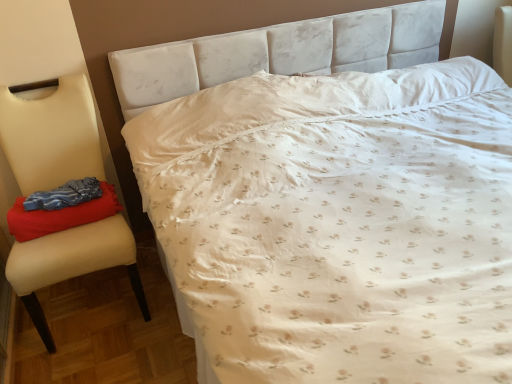
Question: Is beige leather chair at left bigger than velvety red blanket at left?

Choices:
 (A) yes
 (B) no

Answer: (A)

Question: Does beige leather chair at left have a smaller size compared to velvety red blanket at left?

Choices:
 (A) no
 (B) yes

Answer: (A)

Question: From the image's perspective, is beige leather chair at left located above velvety red blanket at left?

Choices:
 (A) no
 (B) yes

Answer: (A)

Question: Is beige leather chair at left not near velvety red blanket at left?

Choices:
 (A) yes
 (B) no

Answer: (B)

Question: Does beige leather chair at left appear on the left side of velvety red blanket at left?

Choices:
 (A) no
 (B) yes

Answer: (B)

Question: Is beige leather chair at left positioned behind velvety red blanket at left?

Choices:
 (A) yes
 (B) no

Answer: (B)

Question: Does velvety red blanket at left have a smaller size compared to beige leather chair at left?

Choices:
 (A) yes
 (B) no

Answer: (A)

Question: From the image's perspective, is velvety red blanket at left below beige leather chair at left?

Choices:
 (A) no
 (B) yes

Answer: (A)

Question: Is the depth of velvety red blanket at left greater than that of beige leather chair at left?

Choices:
 (A) no
 (B) yes

Answer: (B)

Question: Is velvety red blanket at left wider than beige leather chair at left?

Choices:
 (A) no
 (B) yes

Answer: (A)

Question: Is velvety red blanket at left with beige leather chair at left?

Choices:
 (A) no
 (B) yes

Answer: (A)

Question: Can beige leather chair at left be found inside velvety red blanket at left?

Choices:
 (A) no
 (B) yes

Answer: (A)

Question: From a real-world perspective, is beige leather chair at left positioned above or below velvety red blanket at left?

Choices:
 (A) below
 (B) above

Answer: (A)